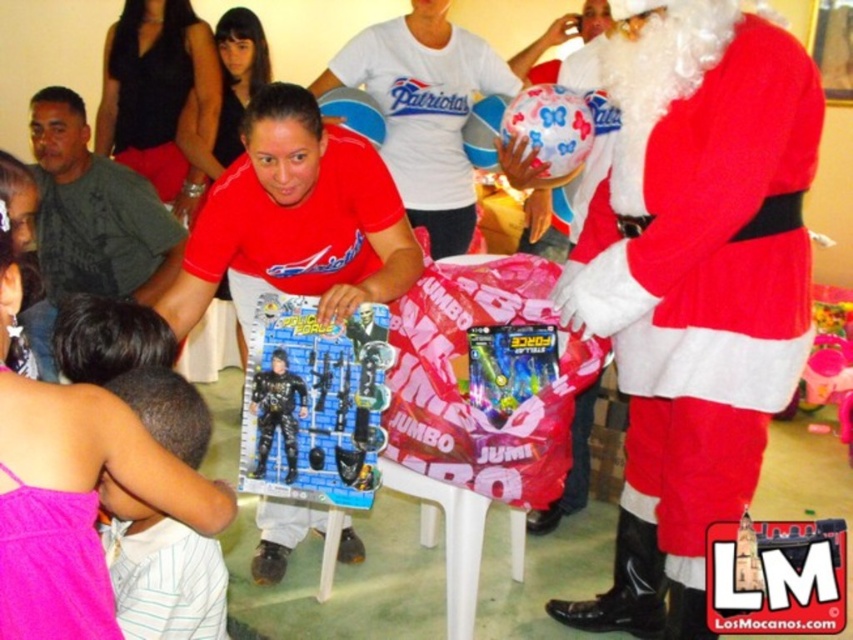
From the picture: Can you confirm if white cotton t-shirt at center is positioned below matte black shirt at center?

Yes, white cotton t-shirt at center is below matte black shirt at center.

Where is `white cotton t-shirt at center`? This screenshot has width=853, height=640. white cotton t-shirt at center is located at coordinates (424, 109).

This screenshot has width=853, height=640. I want to click on white cotton t-shirt at center, so click(424, 109).

This screenshot has width=853, height=640. What are the coordinates of `white cotton t-shirt at center` in the screenshot? It's located at (424, 109).

Is dark green fabric shirt at left above black matte action figure at center?

Indeed, dark green fabric shirt at left is positioned over black matte action figure at center.

Is point (59, 225) positioned after point (270, 358)?

Yes, it is behind point (270, 358).

Identify the location of dark green fabric shirt at left. The width and height of the screenshot is (853, 640). (90, 221).

Can you confirm if pink fabric shirt at lower left is positioned above black matte action figure at center?

No.

Where is `pink fabric shirt at lower left`? This screenshot has width=853, height=640. pink fabric shirt at lower left is located at coordinates (73, 488).

This screenshot has width=853, height=640. Identify the location of pink fabric shirt at lower left. (73, 488).